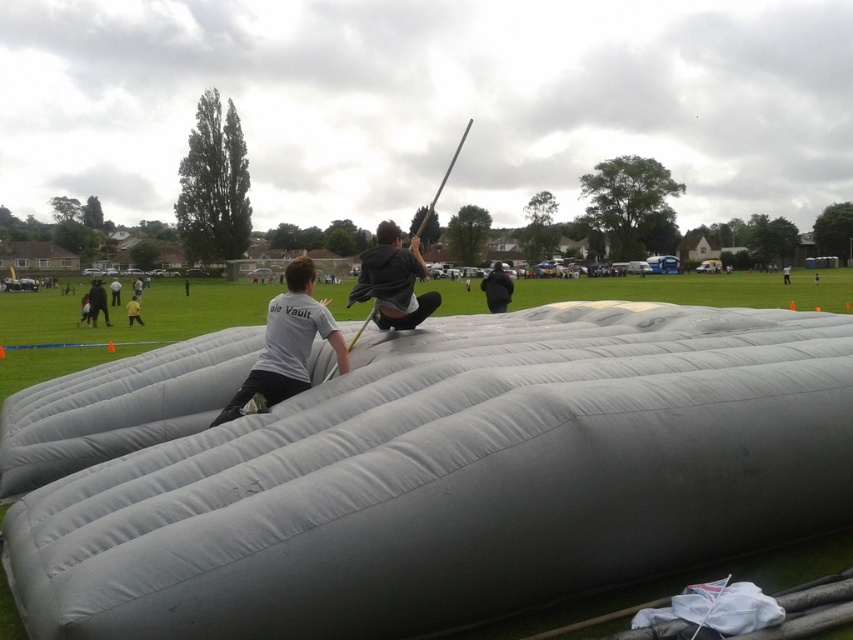
Can you confirm if yellow fabric at lower left is positioned below light gray fabric at center?

Indeed, yellow fabric at lower left is positioned under light gray fabric at center.

Find the location of a particular element. yellow fabric at lower left is located at coordinates (132, 310).

Is point (126, 305) farther from camera compared to point (784, 284)?

No.

Locate an element on the screen. The height and width of the screenshot is (640, 853). yellow fabric at lower left is located at coordinates (132, 310).

How far apart are black matte jacket at center and yellow fabric at lower left?

20.06 meters

Who is lower down, black matte jacket at center or yellow fabric at lower left?

Positioned lower is yellow fabric at lower left.

Where is `black matte jacket at center`? black matte jacket at center is located at coordinates pyautogui.click(x=497, y=289).

Does gray fabric person at left have a greater width compared to light gray fabric at center?

Correct, the width of gray fabric person at left exceeds that of light gray fabric at center.

The height and width of the screenshot is (640, 853). Find the location of `gray fabric person at left`. gray fabric person at left is located at coordinates (97, 301).